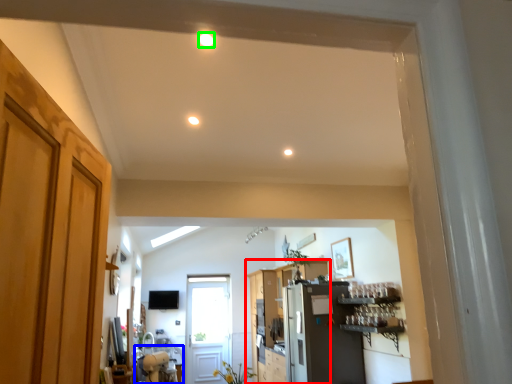
Question: Which is farther away from cabinetry (highlighted by a red box)? table (highlighted by a blue box) or lighting (highlighted by a green box)?

Choices:
 (A) table
 (B) lighting

Answer: (B)